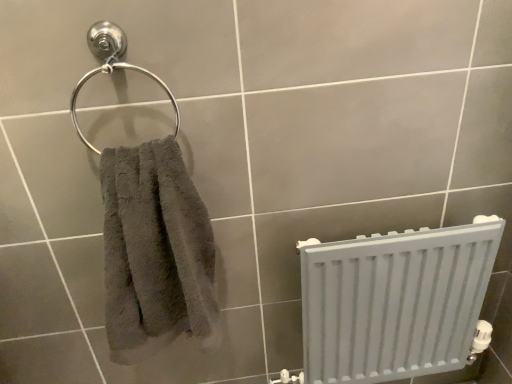
Locate an element on the screen. white matte radiator at lower right is located at coordinates (396, 302).

Considering the relative sizes of satin chrome towel ring at upper left and white matte radiator at lower right in the image provided, is satin chrome towel ring at upper left thinner than white matte radiator at lower right?

Yes, satin chrome towel ring at upper left is thinner than white matte radiator at lower right.

Would you say satin chrome towel ring at upper left is inside or outside white matte radiator at lower right?

satin chrome towel ring at upper left cannot be found inside white matte radiator at lower right.

From the image's perspective, is satin chrome towel ring at upper left positioned above or below white matte radiator at lower right?

satin chrome towel ring at upper left is above white matte radiator at lower right.

You are a GUI agent. You are given a task and a screenshot of the screen. Output one action in this format:
    pyautogui.click(x=<x>, y=<y>)
    Task: Click on the towel bar in front of the white matte radiator at lower right
    
    Given the screenshot: What is the action you would take?
    pyautogui.click(x=112, y=67)

Is gray fluffy towel at left in front of or behind white matte radiator at lower right in the image?

Clearly, gray fluffy towel at left is in front of white matte radiator at lower right.

From the image's perspective, between gray fluffy towel at left and white matte radiator at lower right, who is located below?

white matte radiator at lower right.

Visually, is gray fluffy towel at left positioned to the left or to the right of white matte radiator at lower right?

gray fluffy towel at left is positioned on white matte radiator at lower right's left side.

Is gray fluffy towel at left positioned far away from white matte radiator at lower right?

No, gray fluffy towel at left is not far from white matte radiator at lower right.

Which is farther, (x=417, y=312) or (x=92, y=147)?

The point (x=417, y=312) is farther.

Based on the photo, from the image's perspective, is white matte radiator at lower right positioned above or below satin chrome towel ring at upper left?

white matte radiator at lower right is situated lower than satin chrome towel ring at upper left in the image.

Could satin chrome towel ring at upper left be considered to be inside white matte radiator at lower right?

Definitely not — satin chrome towel ring at upper left is not inside white matte radiator at lower right.

From a real-world perspective, is white matte radiator at lower right above or below satin chrome towel ring at upper left?

In terms of real-world spatial position, white matte radiator at lower right is below satin chrome towel ring at upper left.

Consider the image. Is satin chrome towel ring at upper left taller than gray fluffy towel at left?

No, satin chrome towel ring at upper left is not taller than gray fluffy towel at left.

Based on their sizes in the image, would you say satin chrome towel ring at upper left is bigger or smaller than gray fluffy towel at left?

Clearly, satin chrome towel ring at upper left is smaller in size than gray fluffy towel at left.

Is gray fluffy towel at left completely or partially inside satin chrome towel ring at upper left?

Definitely not — gray fluffy towel at left is not inside satin chrome towel ring at upper left.

From the image's perspective, is satin chrome towel ring at upper left located beneath gray fluffy towel at left?

No.

Do you think white matte radiator at lower right is within gray fluffy towel at left, or outside of it?

The correct answer is: outside.

Consider the image. Is white matte radiator at lower right taller than gray fluffy towel at left?

Yes, white matte radiator at lower right is taller than gray fluffy towel at left.

Considering the relative sizes of white matte radiator at lower right and gray fluffy towel at left in the image provided, is white matte radiator at lower right bigger than gray fluffy towel at left?

Yes.

Find the location of a particular element. The width and height of the screenshot is (512, 384). towel that appears above the white matte radiator at lower right (from a real-world perspective) is located at coordinates (155, 252).

Consider the image. Is gray fluffy towel at left taller than satin chrome towel ring at upper left?

Yes.

Relative to satin chrome towel ring at upper left, is gray fluffy towel at left in front or behind?

gray fluffy towel at left is in front of satin chrome towel ring at upper left.

From a real-world perspective, is gray fluffy towel at left over satin chrome towel ring at upper left?

No, from a real-world perspective, gray fluffy towel at left is not over satin chrome towel ring at upper left

Is point (122, 221) closer or farther from the camera than point (87, 37)?

Point (122, 221) is positioned farther from the camera compared to point (87, 37).

Find the location of a particular element. This screenshot has width=512, height=384. radiator located below the satin chrome towel ring at upper left (from the image's perspective) is located at coordinates (396, 302).

This screenshot has width=512, height=384. Identify the location of towel above the white matte radiator at lower right (from the image's perspective). (155, 252).

Estimate the real-world distances between objects in this image. Which object is closer to gray fluffy towel at left, satin chrome towel ring at upper left or white matte radiator at lower right?

satin chrome towel ring at upper left is closer to gray fluffy towel at left.

Based on the photo, considering their positions, is white matte radiator at lower right positioned further to satin chrome towel ring at upper left than gray fluffy towel at left?

Among the two, white matte radiator at lower right is located further to satin chrome towel ring at upper left.

When comparing their distances from gray fluffy towel at left, does white matte radiator at lower right or satin chrome towel ring at upper left seem closer?

satin chrome towel ring at upper left is closer to gray fluffy towel at left.

Estimate the real-world distances between objects in this image. Which object is further from white matte radiator at lower right, gray fluffy towel at left or satin chrome towel ring at upper left?

satin chrome towel ring at upper left is positioned further to the anchor white matte radiator at lower right.

When comparing their distances from white matte radiator at lower right, does satin chrome towel ring at upper left or gray fluffy towel at left seem closer?

The object closer to white matte radiator at lower right is gray fluffy towel at left.

Estimate the real-world distances between objects in this image. Which object is closer to satin chrome towel ring at upper left, gray fluffy towel at left or white matte radiator at lower right?

gray fluffy towel at left lies closer to satin chrome towel ring at upper left than the other object.

Locate an element on the screen. towel between satin chrome towel ring at upper left and white matte radiator at lower right in the horizontal direction is located at coordinates (155, 252).